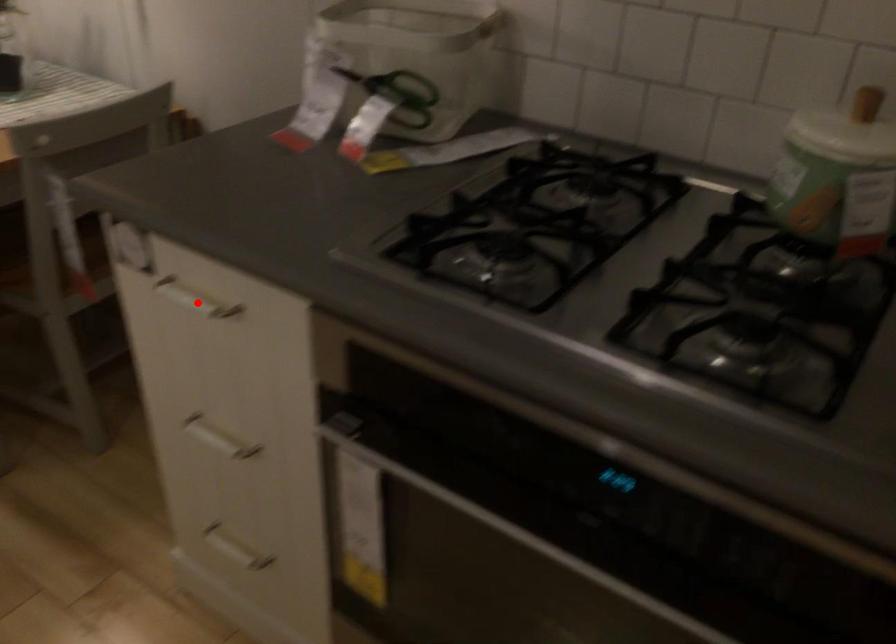
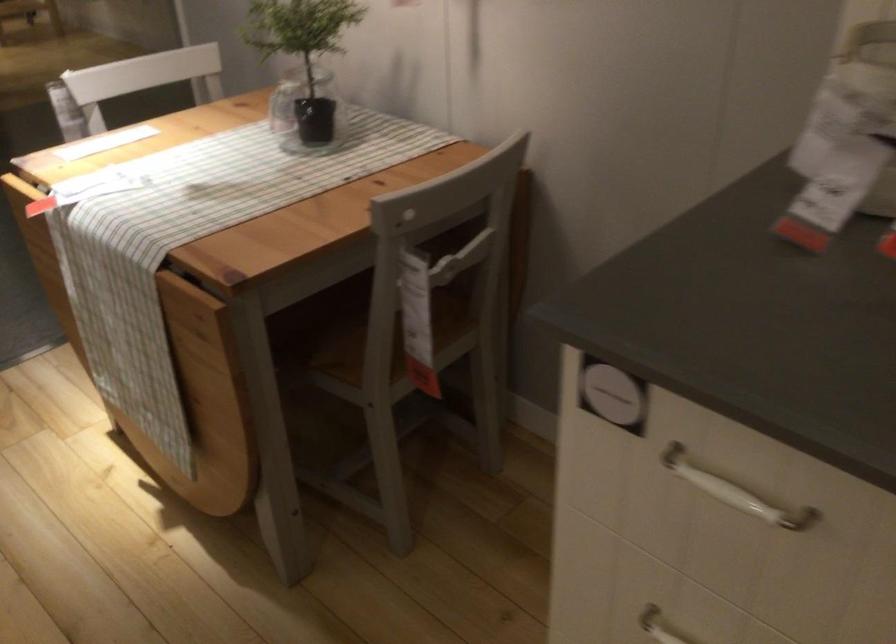
Question: I am providing you with two images of the same scene from different viewpoints. A red point is marked on the first image. Can you still see the location of the red point in image 2?

Choices:
 (A) Yes
 (B) No

Answer: (A)